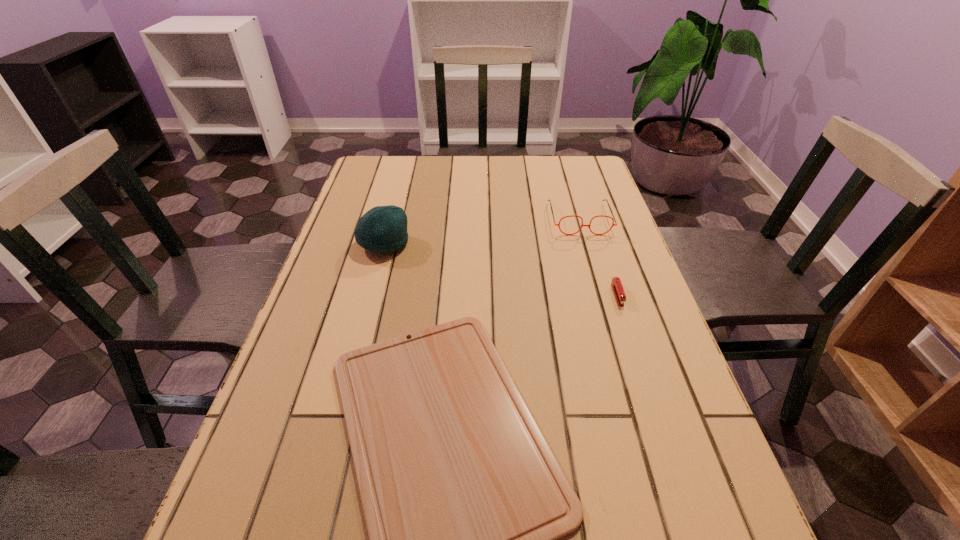
Where is `vacant space at the far edge of the desktop`? vacant space at the far edge of the desktop is located at coordinates (513, 155).

Where is `vacant space at the left edge`? Image resolution: width=960 pixels, height=540 pixels. vacant space at the left edge is located at coordinates point(314,481).

Where is `free space at the right edge of the desktop`? This screenshot has width=960, height=540. free space at the right edge of the desktop is located at coordinates (657, 427).

I want to click on vacant area at the far left corner, so click(369, 180).

Where is `free space between the spectacles and the stapler`? The width and height of the screenshot is (960, 540). free space between the spectacles and the stapler is located at coordinates (598, 256).

At what (x,y) coordinates should I click in order to perform the action: click on vacant region between the tallest object and the second nearest object. Please return your answer as a coordinate pair (x, y). The width and height of the screenshot is (960, 540). Looking at the image, I should click on (500, 269).

The image size is (960, 540). What are the coordinates of `empty space between the tallest object and the second tallest object` in the screenshot? It's located at (481, 232).

Locate which object ranks third in proximity to the nearest object. Please provide its 2D coordinates. Your answer should be formatted as a tuple, i.e. [(x, y)], where the tuple contains the x and y coordinates of a point satisfying the conditions above.

[(613, 224)]

Locate an element on the screen. The image size is (960, 540). the third closest object to the stapler is located at coordinates (383, 229).